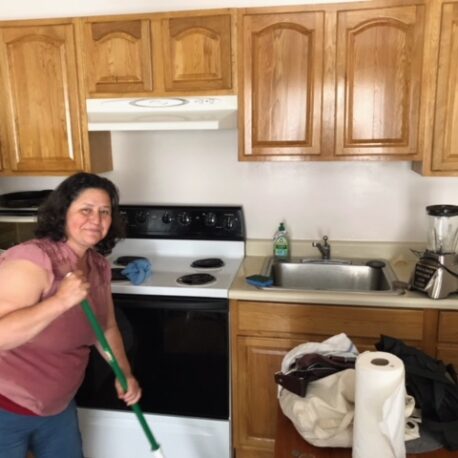
At what (x,y) coordinates should I click in order to perform the action: click on wall cabinets. Please return your answer as a coordinate pair (x, y). The image size is (458, 458). Looking at the image, I should click on (41, 94), (118, 57), (184, 58), (261, 68), (384, 73), (453, 56).